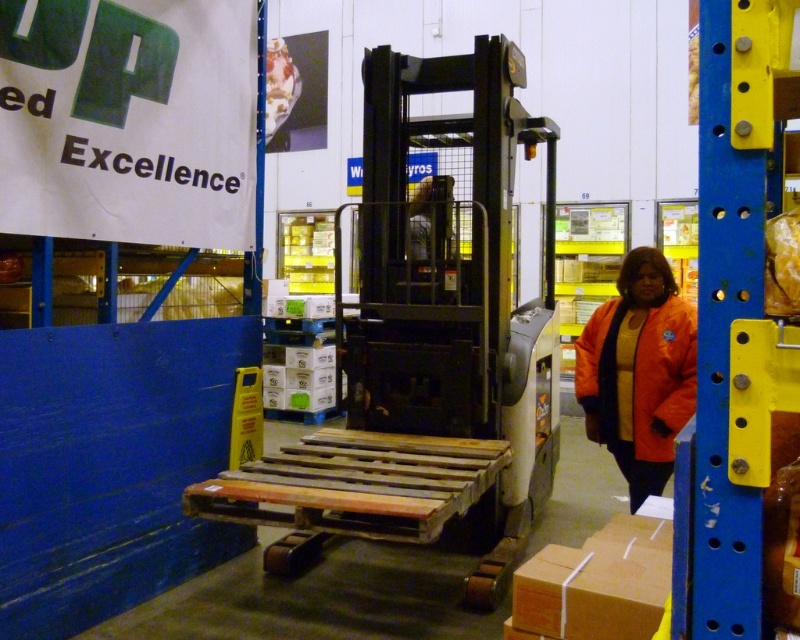
You are an inspector in the warehouse. You need to check the orange matte jacket at lower right but the metallic forklift at center is blocking your path. Can you walk around the forklift to reach the jacket?

The metallic forklift at center is in front of the orange matte jacket at lower right, so you can walk around the forklift to reach the jacket since it is blocking the direct path but not the entire area.

You are a warehouse worker who needs to move an orange matte jacket at lower right from its current position. The path to the storage area is narrow. Given that the metallic forklift at center is parked in the way, can you safely move the jacket around the forklift without hitting it?

The metallic forklift at center is wider than the orange matte jacket at lower right. Since the jacket is narrower, you can safely maneuver around the forklift as long as there is enough space on either side of the forklift to pass without collision.

You are an inspector in the warehouse and need to check the metallic forklift at center. However, there is an orange matte jacket at lower right nearby. Can you safely approach the forklift without stepping on the jacket?

The metallic forklift at center is positioned over orange matte jacket at lower right, meaning the jacket is directly underneath the forklift. Therefore, you cannot safely approach the forklift without stepping on the jacket since it is already covering the area where you would need to walk.